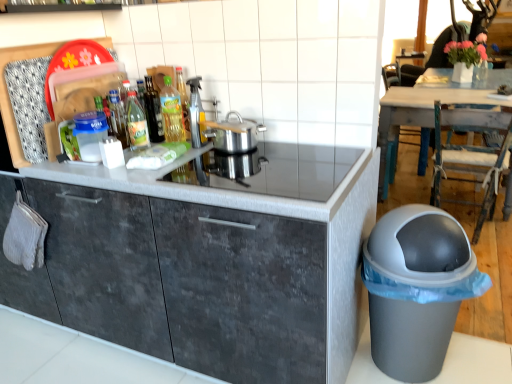
The width and height of the screenshot is (512, 384). What are the coordinates of `free space in front of silver metallic pot at center` in the screenshot? It's located at (239, 162).